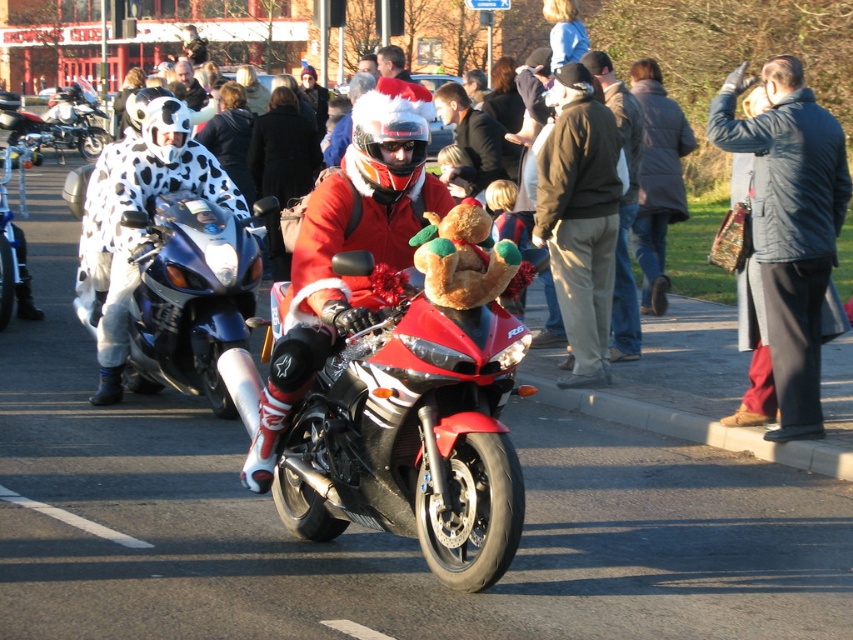
This screenshot has width=853, height=640. What do you see at coordinates (347, 250) in the screenshot?
I see `matte red motorcycle at center` at bounding box center [347, 250].

Can you confirm if matte red motorcycle at center is taller than white painted line at road center?

Correct, matte red motorcycle at center is much taller as white painted line at road center.

Is point (318, 259) farther from camera compared to point (86, 522)?

No, it is not.

Where is `matte red motorcycle at center`? matte red motorcycle at center is located at coordinates (347, 250).

In the scene shown: Is dark blue quilted jacket at upper right bigger than shiny blue motorcycle at left?

Actually, dark blue quilted jacket at upper right might be smaller than shiny blue motorcycle at left.

Is the position of dark blue quilted jacket at upper right more distant than that of shiny blue motorcycle at left?

No, dark blue quilted jacket at upper right is in front of shiny blue motorcycle at left.

Who is more forward, [786,99] or [135,289]?

Point [786,99]

Find the location of a particular element. Image resolution: width=853 pixels, height=640 pixels. dark blue quilted jacket at upper right is located at coordinates (788, 225).

In the scene shown: Which is more to the left, shiny blue motorcycle at left or brown plush teddy bear at center?

shiny blue motorcycle at left is more to the left.

Is point (129, 314) positioned after point (495, 248)?

Yes, it is behind point (495, 248).

Is point (164, 273) farther from viewer compared to point (427, 248)?

Yes, it is.

Find the location of `shiny blue motorcycle at left`. shiny blue motorcycle at left is located at coordinates (190, 296).